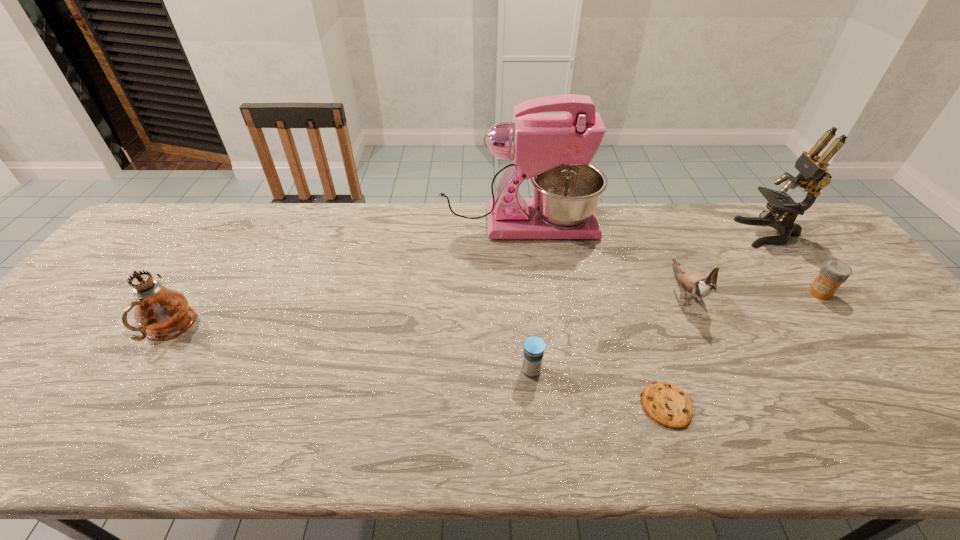
You are a GUI agent. You are given a task and a screenshot of the screen. Output one action in this format:
    pyautogui.click(x=<x>, y=<y>)
    Task: Click on the vacant region located 0.170m on the left of the shortest object
    The image size is (960, 540).
    Given the screenshot: What is the action you would take?
    pyautogui.click(x=564, y=406)

Where is `mixer that is at the far edge`? mixer that is at the far edge is located at coordinates (554, 150).

Locate an element on the screen. microscope that is positioned at the far edge is located at coordinates (813, 176).

Find the location of a particular element. The width and height of the screenshot is (960, 540). object that is positioned at the near edge is located at coordinates (668, 405).

I want to click on microscope at the right edge, so click(x=813, y=176).

This screenshot has width=960, height=540. Find the location of `medicine that is positioned at the right edge`. medicine that is positioned at the right edge is located at coordinates (833, 273).

At what (x,y) coordinates should I click in order to perform the action: click on object located at the far right corner. Please return your answer as a coordinate pair (x, y). The image size is (960, 540). Looking at the image, I should click on point(813,176).

This screenshot has height=540, width=960. I want to click on vacant position at the far edge of the desktop, so click(x=267, y=206).

You are a GUI agent. You are given a task and a screenshot of the screen. Output one action in this format:
    pyautogui.click(x=<x>, y=<y>)
    Task: Click on the vacant space at the near edge of the desktop
    The image size is (960, 540).
    Given the screenshot: What is the action you would take?
    pyautogui.click(x=712, y=457)

In the image, there is a desktop. Identify the location of vacant space at the left edge. Image resolution: width=960 pixels, height=540 pixels. (67, 324).